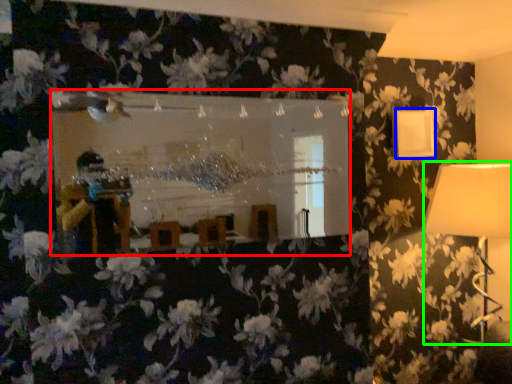
Question: Estimate the real-world distances between objects in this image. Which object is closer to mirror (highlighted by a red box), lamp (highlighted by a blue box) or lamp (highlighted by a green box)?

Choices:
 (A) lamp
 (B) lamp

Answer: (A)